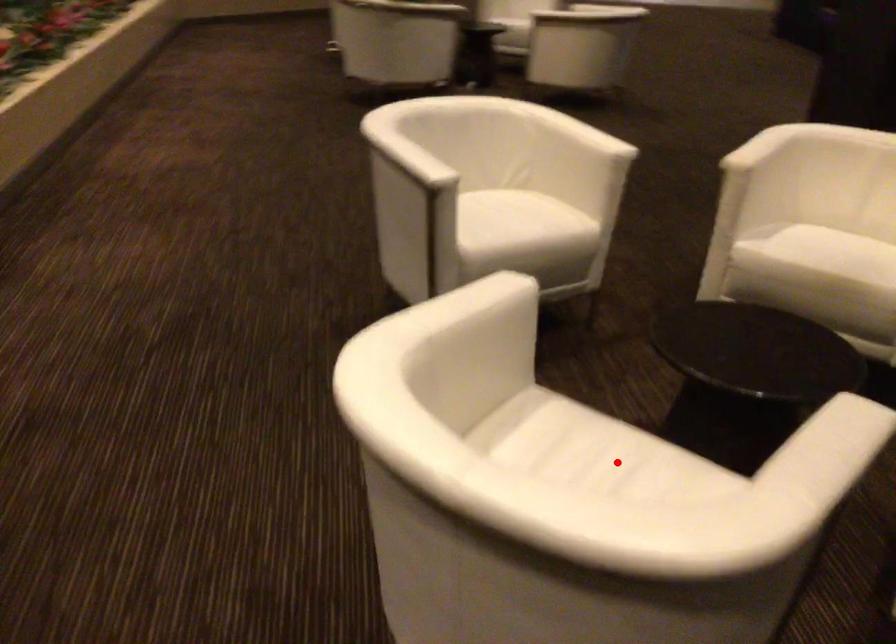
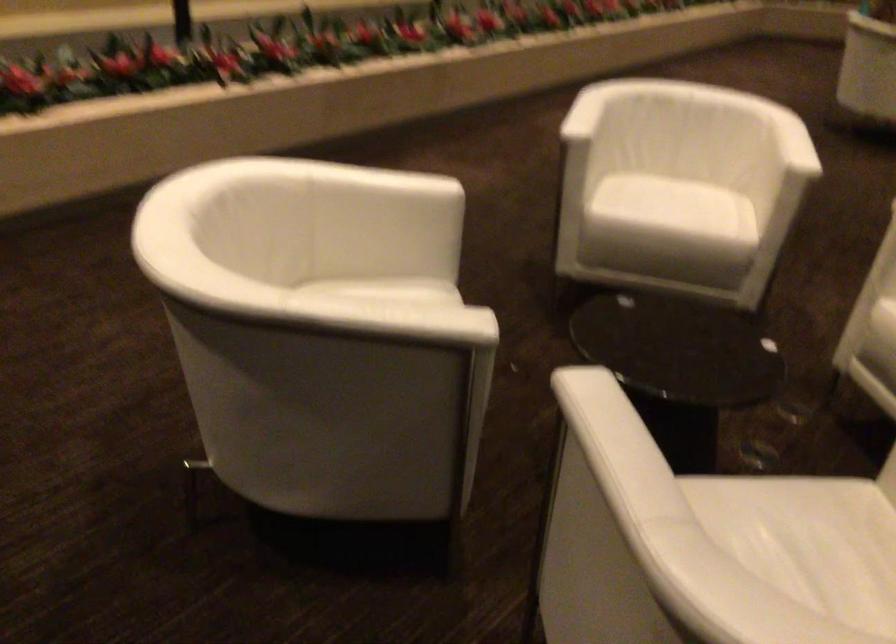
Question: I am providing you with two images of the same scene from different viewpoints. A red point is marked on the first image. Is the red point's position out of view in image 2?

Choices:
 (A) Yes
 (B) No

Answer: (A)